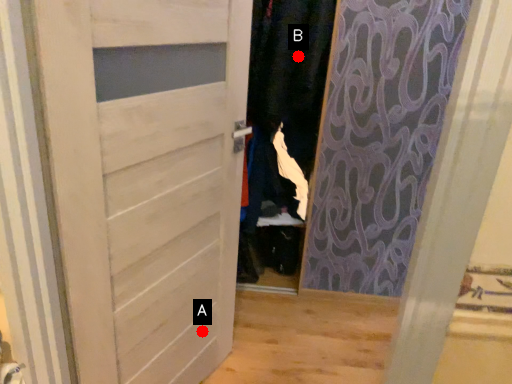
Question: Two points are circled on the image, labeled by A and B beside each circle. Among these points, which one is nearest to the camera?

Choices:
 (A) A is closer
 (B) B is closer

Answer: (A)